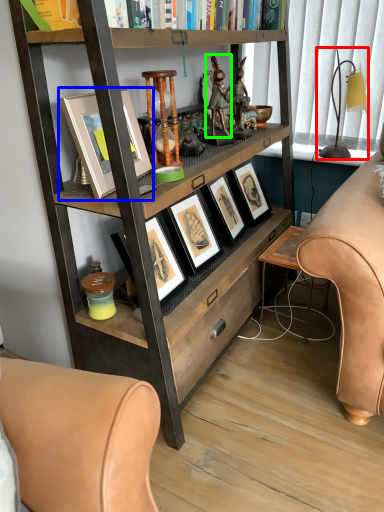
Question: Based on their relative distances, which object is nearer to table lamp (highlighted by a red box)? Choose from picture frame (highlighted by a blue box) and animal (highlighted by a green box).

Choices:
 (A) picture frame
 (B) animal

Answer: (B)